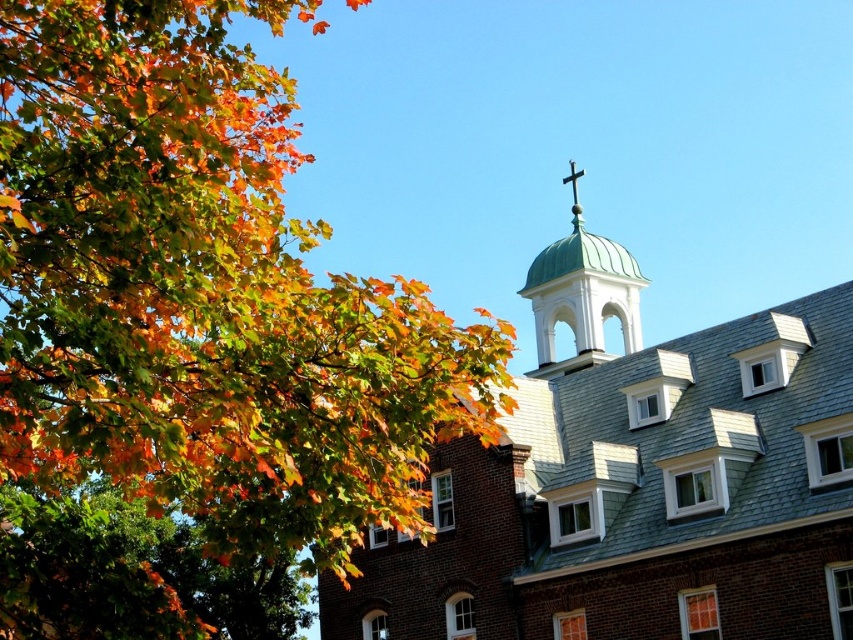
Is autumn leaves at upper left below green copper dome at upper center?

No, autumn leaves at upper left is not below green copper dome at upper center.

Is autumn leaves at upper left to the left of green copper dome at upper center from the viewer's perspective?

Correct, you'll find autumn leaves at upper left to the left of green copper dome at upper center.

Does point (167, 321) lie behind point (575, 188)?

No, it is not.

The image size is (853, 640). I want to click on autumn leaves at upper left, so click(x=202, y=291).

Which of these two, green dome at upper center or green copper dome at upper center, stands taller?

green dome at upper center is taller.

Who is positioned more to the left, green dome at upper center or green copper dome at upper center?

green dome at upper center is more to the left.

Find the location of a particular element. green dome at upper center is located at coordinates (634, 481).

Is point (144, 211) positioned before point (708, 620)?

Yes.

Who is more distant from viewer, (270, 212) or (556, 545)?

Point (556, 545)

Which is behind, point (412, 369) or point (457, 602)?

The point (457, 602) is behind.

I want to click on autumn leaves at upper left, so click(x=202, y=291).